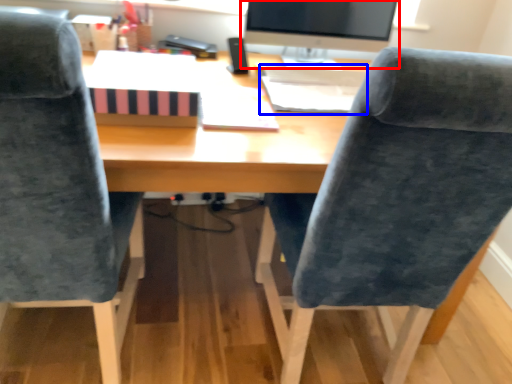
Question: Which object appears closest to the camera in this image, computer monitor (highlighted by a red box) or book (highlighted by a blue box)?

Choices:
 (A) computer monitor
 (B) book

Answer: (B)